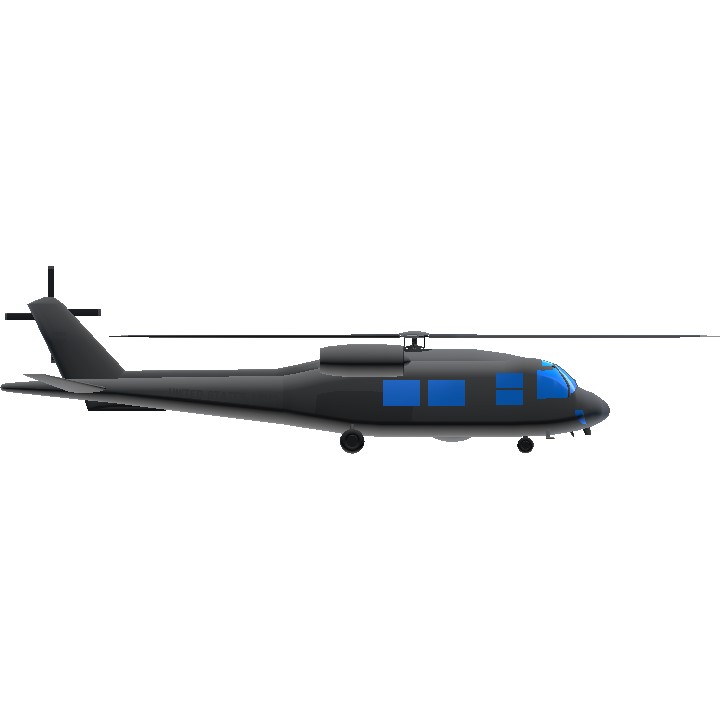
Where is `blue window markings`? The image size is (720, 720). blue window markings is located at coordinates (546, 378), (518, 378), (515, 399), (448, 395), (405, 397), (572, 386).